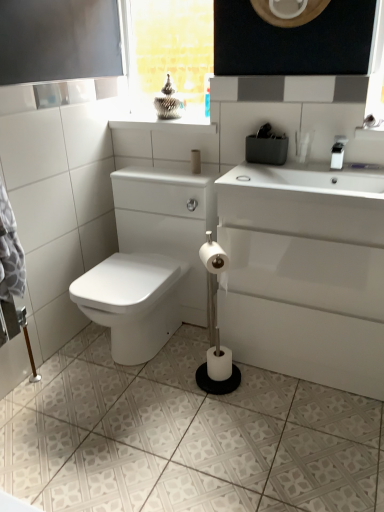
The height and width of the screenshot is (512, 384). In order to click on empty space that is ontop of white glossy ceramic tile at lower center (from a real-world perspective) in this screenshot , I will do `click(165, 414)`.